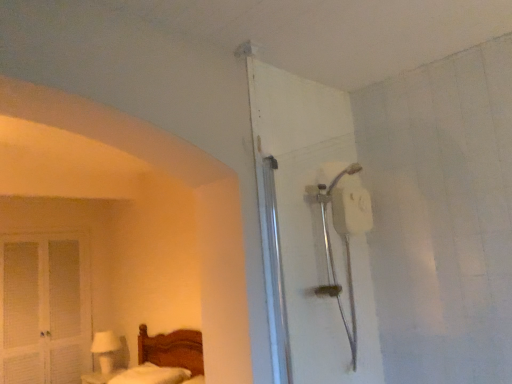
Question: Is white glossy table lamp at lower left located outside white matte shower head at upper right?

Choices:
 (A) yes
 (B) no

Answer: (A)

Question: From the image's perspective, is white glossy table lamp at lower left beneath white matte shower head at upper right?

Choices:
 (A) yes
 (B) no

Answer: (A)

Question: Is white glossy table lamp at lower left at the right side of white matte shower head at upper right?

Choices:
 (A) no
 (B) yes

Answer: (A)

Question: Does white glossy table lamp at lower left lie in front of white matte shower head at upper right?

Choices:
 (A) no
 (B) yes

Answer: (A)

Question: Can you confirm if white glossy table lamp at lower left is shorter than white matte shower head at upper right?

Choices:
 (A) yes
 (B) no

Answer: (A)

Question: Can you confirm if white glossy table lamp at lower left is wider than white matte shower head at upper right?

Choices:
 (A) no
 (B) yes

Answer: (A)

Question: From a real-world perspective, is white louvered screen door at left on white matte shower head at upper right?

Choices:
 (A) yes
 (B) no

Answer: (B)

Question: Does white louvered screen door at left have a larger size compared to white matte shower head at upper right?

Choices:
 (A) yes
 (B) no

Answer: (A)

Question: Is white louvered screen door at left facing away from white matte shower head at upper right?

Choices:
 (A) no
 (B) yes

Answer: (A)

Question: Is white louvered screen door at left outside white matte shower head at upper right?

Choices:
 (A) no
 (B) yes

Answer: (B)

Question: Could you tell me if white louvered screen door at left is turned towards white matte shower head at upper right?

Choices:
 (A) no
 (B) yes

Answer: (B)

Question: Considering the relative sizes of white louvered screen door at left and white matte shower head at upper right in the image provided, is white louvered screen door at left taller than white matte shower head at upper right?

Choices:
 (A) no
 (B) yes

Answer: (B)

Question: Is white matte shower head at upper right positioned beyond the bounds of white fluffy mattress at lower left?

Choices:
 (A) yes
 (B) no

Answer: (A)